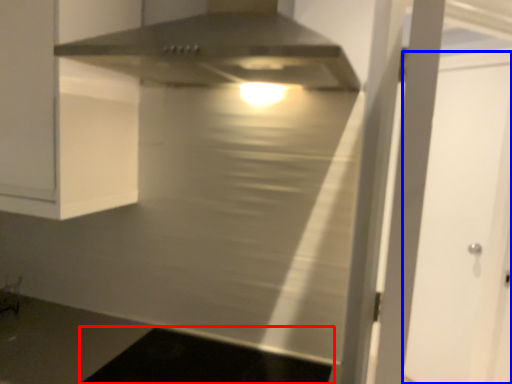
Question: Which of the following is the closest to the observer, dark (highlighted by a red box) or glass door (highlighted by a blue box)?

Choices:
 (A) dark
 (B) glass door

Answer: (A)